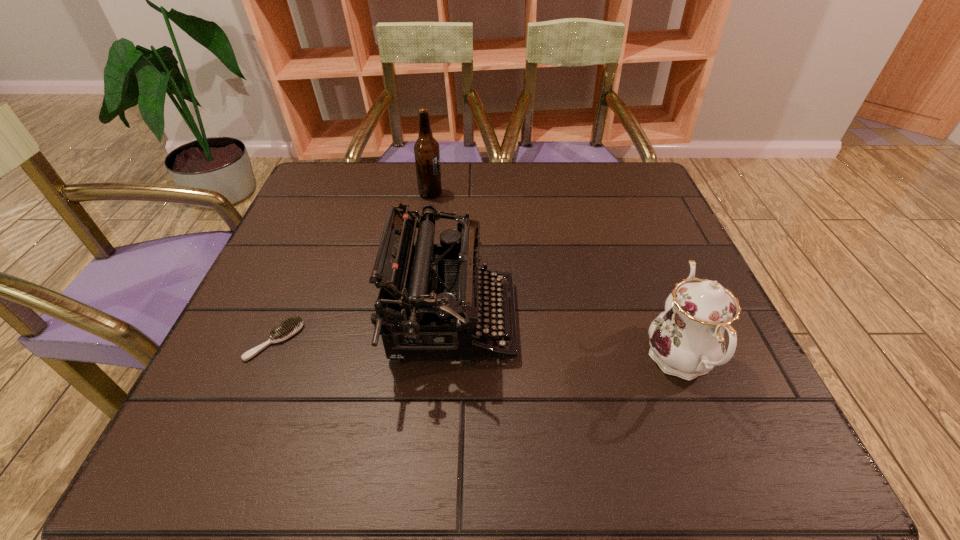
This screenshot has height=540, width=960. Identify the location of the farthest object. (426, 149).

At what (x,y) coordinates should I click in order to perform the action: click on typewriter. Please return your answer as a coordinate pair (x, y). The width and height of the screenshot is (960, 540). Looking at the image, I should click on (447, 293).

You are a GUI agent. You are given a task and a screenshot of the screen. Output one action in this format:
    pyautogui.click(x=<x>, y=<y>)
    Task: Click on the rightmost object
    
    Given the screenshot: What is the action you would take?
    pyautogui.click(x=687, y=340)

Where is `the shortest object`? the shortest object is located at coordinates (290, 327).

Where is `scrubbing brush`? scrubbing brush is located at coordinates (290, 327).

Find the location of a particular element. free region located 0.310m on the label of the farthest object is located at coordinates (556, 194).

The height and width of the screenshot is (540, 960). I want to click on vacant space located 0.050m on the keyboard of the typewriter, so click(540, 320).

Where is `vacant position located on the left of the rightmost object`? This screenshot has height=540, width=960. vacant position located on the left of the rightmost object is located at coordinates (515, 359).

Locate an element on the screen. This screenshot has width=960, height=540. free point located on the right of the scrubbing brush is located at coordinates (435, 341).

The image size is (960, 540). Identify the location of object that is at the far edge. (426, 149).